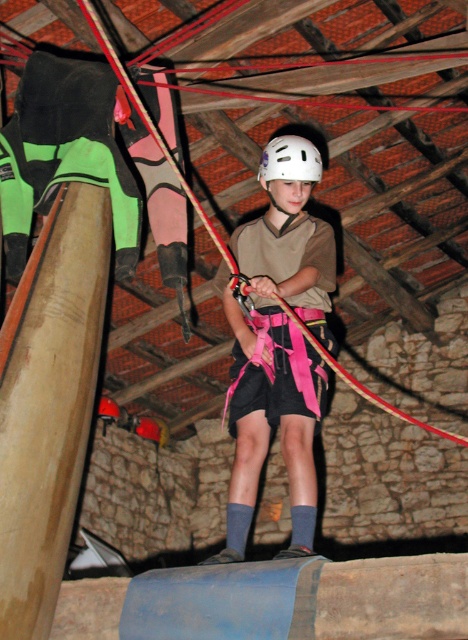
Question: Which object appears farthest from the camera in this image?

Choices:
 (A) brown wood beam at left
 (B) pink fabric harness at center

Answer: (B)

Question: Is pink fabric rope at center below white matte helmet at center?

Choices:
 (A) yes
 (B) no

Answer: (B)

Question: Which point is closer to the camera?

Choices:
 (A) (108, 227)
 (B) (402, 307)
 (C) (308, 156)
 (D) (246, 257)

Answer: (A)

Question: Estimate the real-world distances between objects in this image. Which object is farther from the pink fabric harness at center?

Choices:
 (A) white matte helmet at center
 (B) brown wood beam at left

Answer: (B)

Question: Can you confirm if pink fabric rope at center is positioned above brown wood beam at left?

Choices:
 (A) no
 (B) yes

Answer: (B)

Question: Is the position of pink fabric rope at center more distant than that of pink fabric harness at center?

Choices:
 (A) no
 (B) yes

Answer: (B)